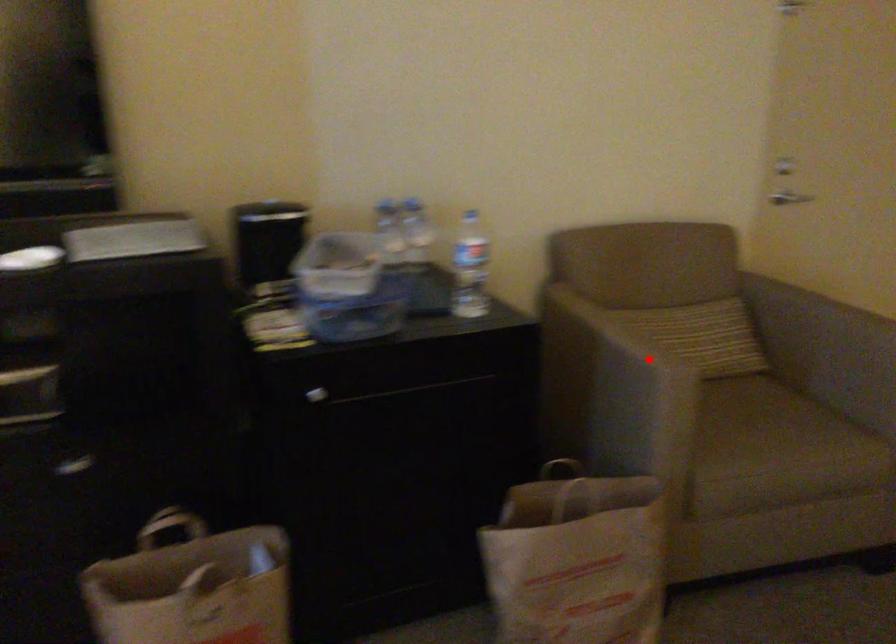
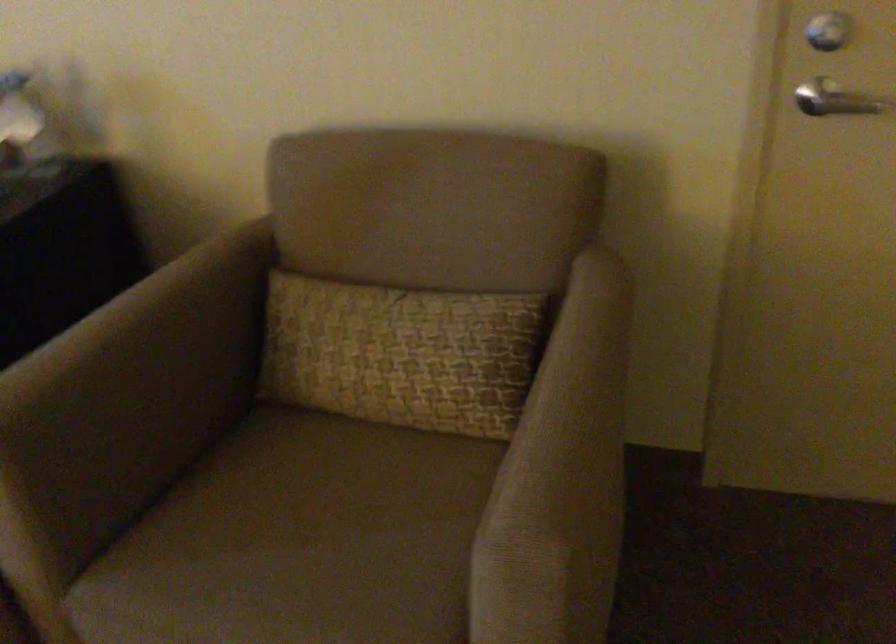
The point at the highlighted location is marked in the first image. Where is the corresponding point in the second image?

(135, 389)